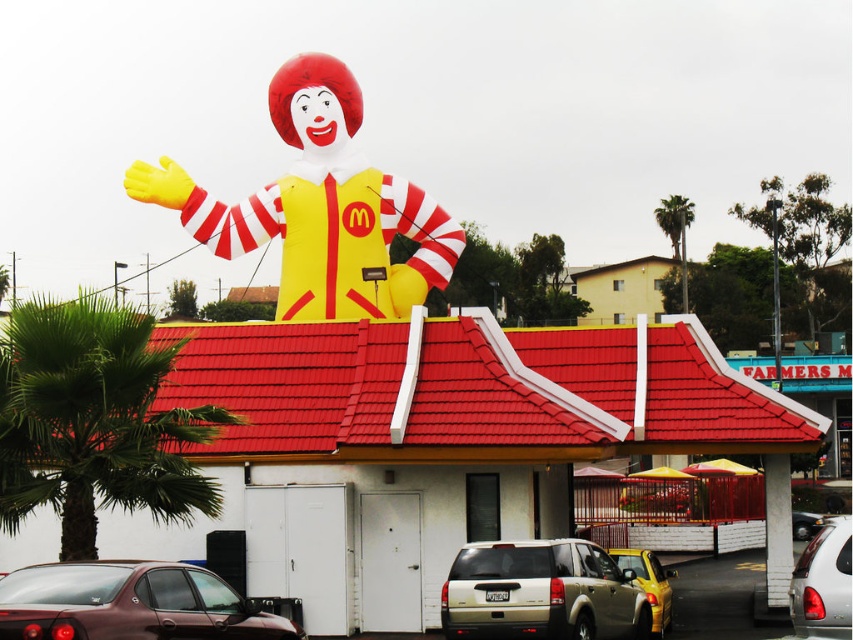
You are a photographer standing at the camera position. You want to take a photo of the matte yellow plastic Ronald McDonald at center. However, you need to ensure that the subject is within the 200 feet focal range of your camera lens. Can you capture the subject clearly?

The distance between the matte yellow plastic Ronald McDonald at center and the camera is 223.60 feet, which exceeds the 200 feet focal range. Therefore, you cannot capture the subject clearly with the current camera settings.

You are a customer standing in front of the McDonalds restaurant. You see the green leafy palm tree at left and the silver metallic car at lower right. Which object is taller?

The green leafy palm tree at left is much taller than the silver metallic car at lower right.

You are a delivery driver who needs to park your vehicle, which is 5 meters long, between the gold metallic suv at lower center and the metallic silver car at center. Is there enough space for your vehicle to fit between them?

The distance between the gold metallic suv at lower center and the metallic silver car at center is 47.17 meters. Since your vehicle is only 5 meters long, there is ample space to park between them.